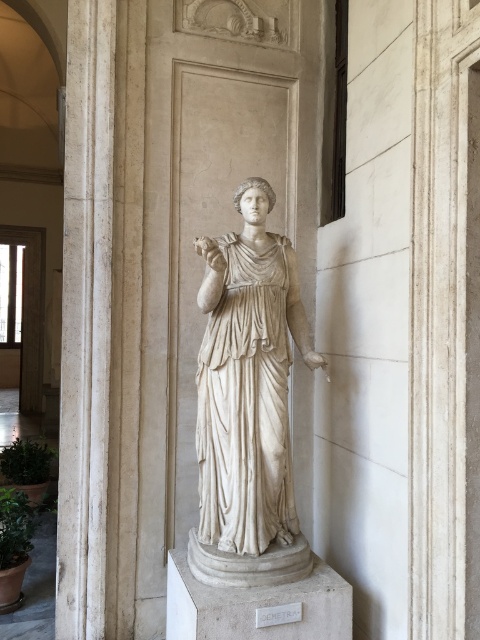
Does white marble statue at center have a greater height compared to white marble pillar at center?

Incorrect, white marble statue at center's height is not larger of white marble pillar at center's.

Who is more distant from viewer, (203, 444) or (70, 470)?

Positioned behind is point (70, 470).

Where is `white marble statue at center`? The width and height of the screenshot is (480, 640). white marble statue at center is located at coordinates 248,381.